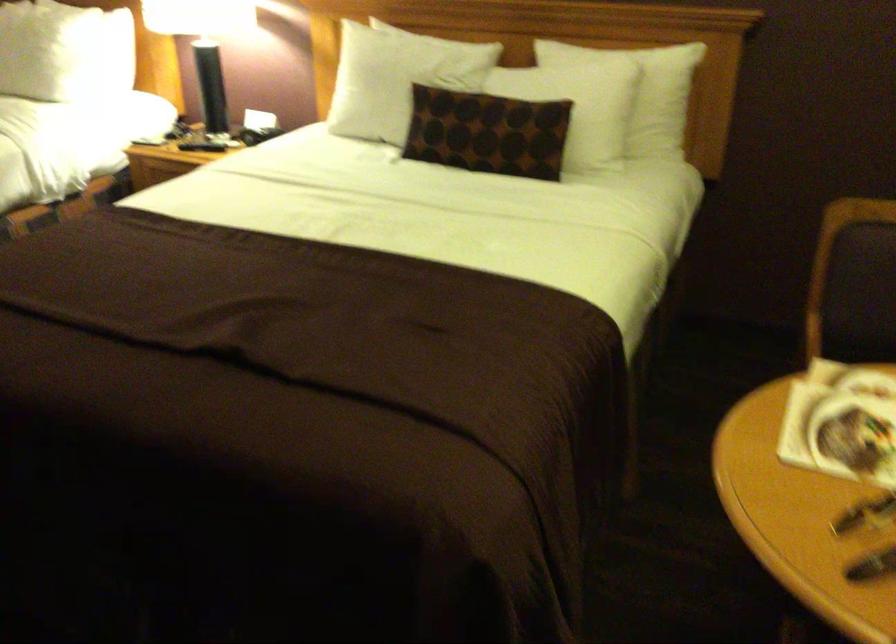
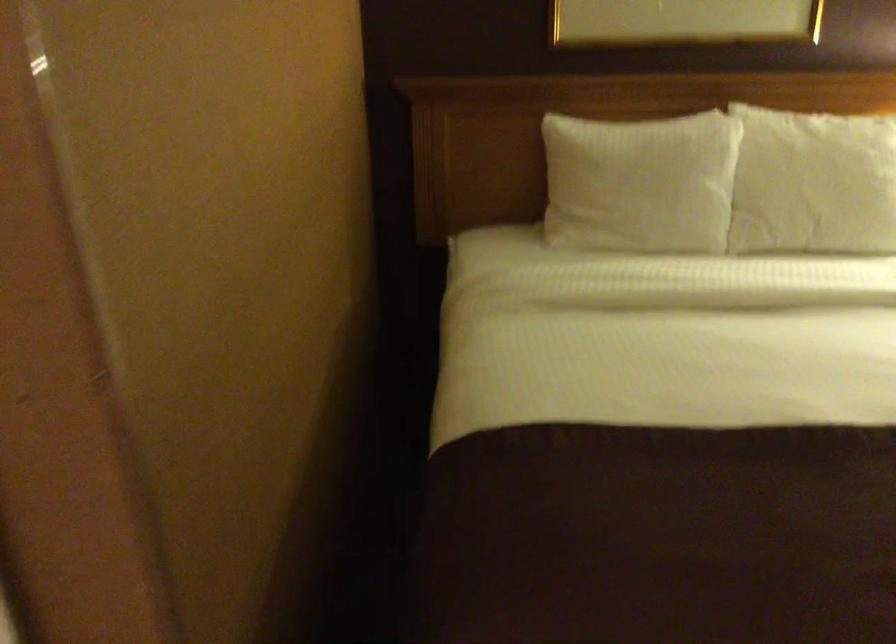
What movement of the cameraman would produce the second image?

The cameraman moved toward left, forward.